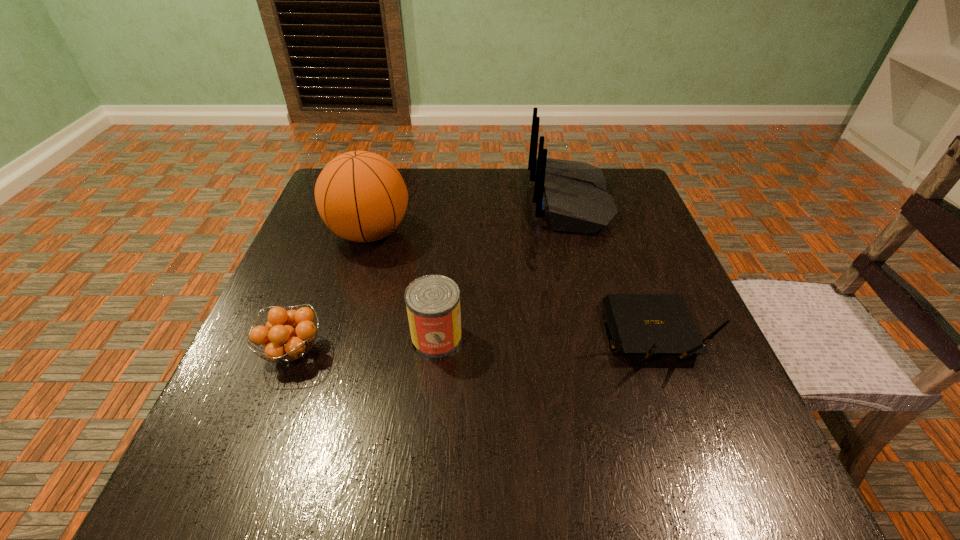
This screenshot has width=960, height=540. What are the coordinates of `empty space that is in between the nearer router and the orange fruit` in the screenshot? It's located at (470, 343).

The height and width of the screenshot is (540, 960). Identify the location of vacant region between the shorter router and the taller router. (609, 268).

Locate an element on the screen. free area in between the third object from left to right and the nearer router is located at coordinates (542, 336).

You are a GUI agent. You are given a task and a screenshot of the screen. Output one action in this format:
    pyautogui.click(x=<x>, y=<y>)
    Task: Click on the object that is the second closest to the orange fruit
    
    Given the screenshot: What is the action you would take?
    pyautogui.click(x=361, y=196)

Find the location of a particular element. The image size is (960, 540). object that is the closest to the basketball is located at coordinates (433, 301).

Locate an element on the screen. vacant region that satisfies the following two spatial constraints: 1. on the back of the taller router; 2. on the front side of the basketball is located at coordinates (578, 233).

This screenshot has height=540, width=960. I want to click on free spot that satisfies the following two spatial constraints: 1. on the back of the taller router; 2. on the right side of the shorter router, so click(x=605, y=335).

I want to click on vacant position in the image that satisfies the following two spatial constraints: 1. on the back side of the basketball; 2. on the right side of the orange fruit, so click(338, 233).

Where is `free region that satisfies the following two spatial constraints: 1. on the back of the taller router; 2. on the front side of the orange fruit`? This screenshot has width=960, height=540. free region that satisfies the following two spatial constraints: 1. on the back of the taller router; 2. on the front side of the orange fruit is located at coordinates (610, 351).

Image resolution: width=960 pixels, height=540 pixels. What are the coordinates of `vacant position in the image that satisfies the following two spatial constraints: 1. on the back of the taller router; 2. on the front side of the can` in the screenshot? It's located at click(606, 338).